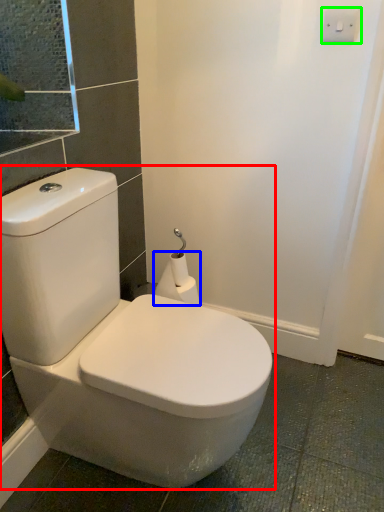
Question: Based on their relative distances, which object is farther from toilet (highlighted by a red box)? Choose from toilet paper (highlighted by a blue box) and light switch (highlighted by a green box).

Choices:
 (A) toilet paper
 (B) light switch

Answer: (B)